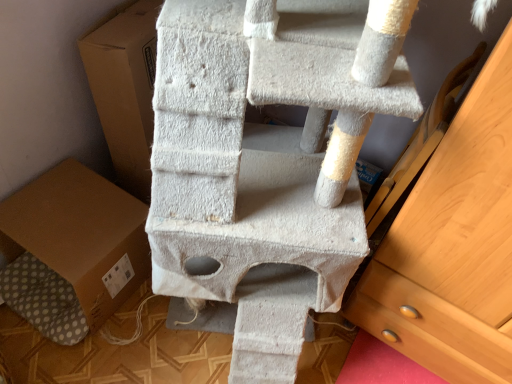
What is the approximate height of brown cardboard box at lower left?

12.82 inches.

Measure the distance between brown cardboard box at lower left and camera.

brown cardboard box at lower left is 1.13 meters from camera.

This screenshot has width=512, height=384. Identify the location of brown cardboard box at lower left. (80, 235).

What do you see at coordinates (80, 235) in the screenshot? The width and height of the screenshot is (512, 384). I see `brown cardboard box at lower left` at bounding box center [80, 235].

Where is `wooden chest of drawers at right`? wooden chest of drawers at right is located at coordinates (453, 246).

Describe the element at coordinates (453, 246) in the screenshot. The image size is (512, 384). I see `wooden chest of drawers at right` at that location.

Locate an element on the screen. The height and width of the screenshot is (384, 512). brown cardboard box at lower left is located at coordinates (80, 235).

Based on their positions, is wooden chest of drawers at right located to the left or right of brown cardboard box at lower left?

In the image, wooden chest of drawers at right appears on the right side of brown cardboard box at lower left.

Is the position of wooden chest of drawers at right less distant than that of brown cardboard box at lower left?

Yes.

Which is farther from the camera, [500,373] or [57,264]?

The point [57,264] is farther from the camera.

From the image's perspective, is wooden chest of drawers at right located above brown cardboard box at lower left?

Correct, wooden chest of drawers at right appears higher than brown cardboard box at lower left in the image.

From a real-world perspective, is wooden chest of drawers at right positioned under brown cardboard box at lower left based on gravity?

Actually, wooden chest of drawers at right is physically above brown cardboard box at lower left in the real world.

Which of these two, wooden chest of drawers at right or brown cardboard box at lower left, is thinner?

Thinner between the two is wooden chest of drawers at right.

Considering the sizes of objects wooden chest of drawers at right and brown cardboard box at lower left in the image provided, who is shorter, wooden chest of drawers at right or brown cardboard box at lower left?

brown cardboard box at lower left is shorter.

Considering the relative sizes of wooden chest of drawers at right and brown cardboard box at lower left in the image provided, is wooden chest of drawers at right bigger than brown cardboard box at lower left?

No.

Can brown cardboard box at lower left be found inside wooden chest of drawers at right?

Actually, brown cardboard box at lower left is outside wooden chest of drawers at right.

Looking at this image, does wooden chest of drawers at right touch brown cardboard box at lower left?

No, wooden chest of drawers at right is not touching brown cardboard box at lower left.

Is wooden chest of drawers at right oriented away from brown cardboard box at lower left?

No.

In the scene shown: How many degrees apart are the facing directions of wooden chest of drawers at right and brown cardboard box at lower left?

They differ by 0.000409 degrees in their facing directions.

I want to click on cardboard box below the wooden chest of drawers at right (from the image's perspective), so click(80, 235).

Is brown cardboard box at lower left at the right side of wooden chest of drawers at right?

In fact, brown cardboard box at lower left is to the left of wooden chest of drawers at right.

Which is in front, brown cardboard box at lower left or wooden chest of drawers at right?

wooden chest of drawers at right is in front.

Is point (67, 187) closer to viewer compared to point (488, 293)?

That is False.

From the image's perspective, would you say brown cardboard box at lower left is positioned over wooden chest of drawers at right?

Actually, brown cardboard box at lower left appears below wooden chest of drawers at right in the image.

From a real-world perspective, relative to wooden chest of drawers at right, is brown cardboard box at lower left vertically above or below?

In terms of real-world spatial position, brown cardboard box at lower left is below wooden chest of drawers at right.

Can you confirm if brown cardboard box at lower left is thinner than wooden chest of drawers at right?

In fact, brown cardboard box at lower left might be wider than wooden chest of drawers at right.

Can you confirm if brown cardboard box at lower left is taller than wooden chest of drawers at right?

Incorrect, the height of brown cardboard box at lower left is not larger of that of wooden chest of drawers at right.

Is brown cardboard box at lower left bigger or smaller than wooden chest of drawers at right?

Considering their sizes, brown cardboard box at lower left takes up more space than wooden chest of drawers at right.

Which is correct: brown cardboard box at lower left is inside wooden chest of drawers at right, or outside of it?

brown cardboard box at lower left exists outside the volume of wooden chest of drawers at right.

Are brown cardboard box at lower left and wooden chest of drawers at right located far from each other?

Actually, brown cardboard box at lower left and wooden chest of drawers at right are a little close together.

Is brown cardboard box at lower left positioned with its back to wooden chest of drawers at right?

brown cardboard box at lower left is not turned away from wooden chest of drawers at right.

Locate an element on the screen. cardboard box located below the wooden chest of drawers at right (from the image's perspective) is located at coordinates (80, 235).

The height and width of the screenshot is (384, 512). In order to click on cardboard box that appears below the wooden chest of drawers at right (from the image's perspective) in this screenshot , I will do `click(80, 235)`.

I want to click on chest of drawers on the right of brown cardboard box at lower left, so click(453, 246).